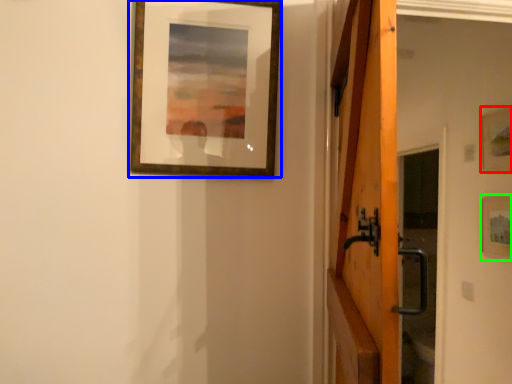
Question: Considering the real-world distances, which object is closest to picture frame (highlighted by a red box)? picture frame (highlighted by a blue box) or picture frame (highlighted by a green box).

Choices:
 (A) picture frame
 (B) picture frame

Answer: (B)